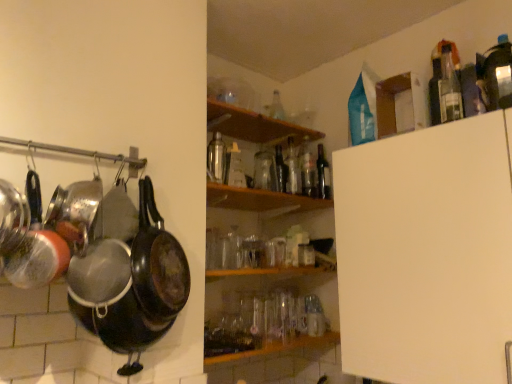
Question: Is black matte frying pan at left located outside clear glass bottle at upper right, arranged as the first bottle when viewed from the front?

Choices:
 (A) no
 (B) yes

Answer: (B)

Question: Is black matte frying pan at left taller than clear glass bottle at upper right, the sixth bottle positioned from the left?

Choices:
 (A) yes
 (B) no

Answer: (A)

Question: Is clear glass bottle at upper right, the sixth bottle positioned from the back, at the back of black matte frying pan at left?

Choices:
 (A) yes
 (B) no

Answer: (B)

Question: Is black matte frying pan at left not near clear glass bottle at upper right, the sixth bottle positioned from the back?

Choices:
 (A) yes
 (B) no

Answer: (B)

Question: Considering the relative sizes of black matte frying pan at left and clear glass bottle at upper right, arranged as the first bottle when viewed from the front, in the image provided, is black matte frying pan at left thinner than clear glass bottle at upper right, arranged as the first bottle when viewed from the front,?

Choices:
 (A) no
 (B) yes

Answer: (A)

Question: Does black matte frying pan at left lie in front of clear glass bottle at upper right, the sixth bottle positioned from the back?

Choices:
 (A) yes
 (B) no

Answer: (A)

Question: From a real-world perspective, is transparent glass bottle at center, positioned as the 2th bottle in left-to-right order, physically above wooden shelf at upper center, arranged as the 1th shelf when viewed from the top?

Choices:
 (A) yes
 (B) no

Answer: (B)

Question: Is wooden shelf at upper center, arranged as the 1th shelf when viewed from the top, inside transparent glass bottle at center, positioned as the 3th bottle in front-to-back order?

Choices:
 (A) yes
 (B) no

Answer: (B)

Question: Does transparent glass bottle at center, positioned as the fourth bottle in back-to-front order, turn towards wooden shelf at upper center, which is the 2th shelf from bottom to top?

Choices:
 (A) no
 (B) yes

Answer: (A)

Question: Does transparent glass bottle at center, positioned as the 3th bottle in front-to-back order, lie behind wooden shelf at upper center, arranged as the 1th shelf when viewed from the top?

Choices:
 (A) yes
 (B) no

Answer: (A)

Question: Can you confirm if transparent glass bottle at center, positioned as the 3th bottle in front-to-back order, is smaller than wooden shelf at upper center, which is the 2th shelf from bottom to top?

Choices:
 (A) no
 (B) yes

Answer: (B)

Question: Is transparent glass bottle at center, positioned as the 3th bottle in front-to-back order, positioned far away from wooden shelf at upper center, which is the 2th shelf from bottom to top?

Choices:
 (A) yes
 (B) no

Answer: (B)

Question: From the image's perspective, would you say wooden shelf at center, the 2th shelf when ordered from top to bottom, is shown under dark glass bottle at upper center, the sixth bottle viewed from the front?

Choices:
 (A) no
 (B) yes

Answer: (B)